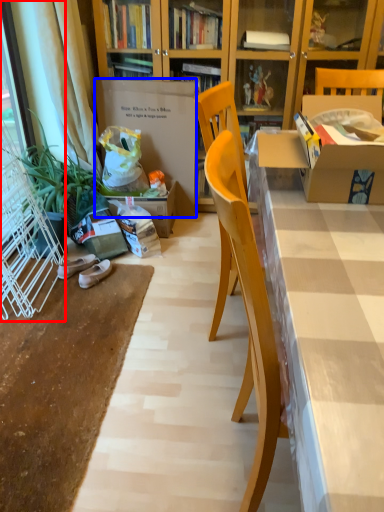
Question: Which object is further to the camera taking this photo, screen door (highlighted by a red box) or cardboard box (highlighted by a blue box)?

Choices:
 (A) screen door
 (B) cardboard box

Answer: (B)